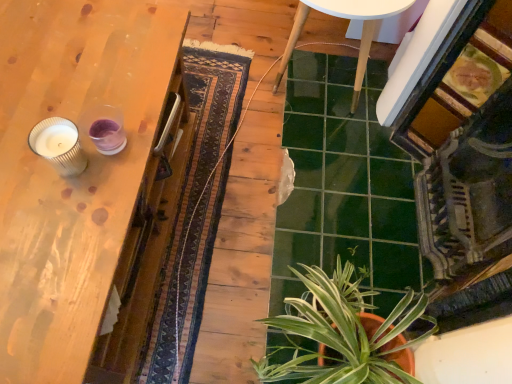
Where is `free space to the left of green glossy plant at lower right`? free space to the left of green glossy plant at lower right is located at coordinates (202, 289).